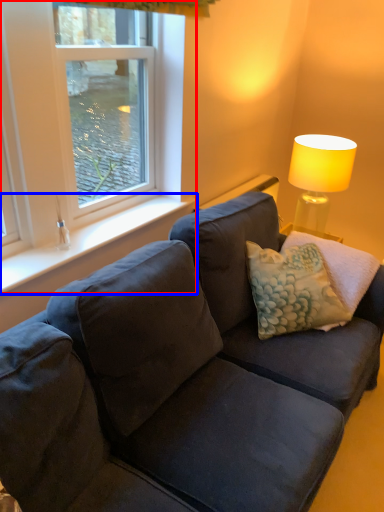
Question: Which of the following is the closest to the observer, window (highlighted by a red box) or window sill (highlighted by a blue box)?

Choices:
 (A) window
 (B) window sill

Answer: (A)